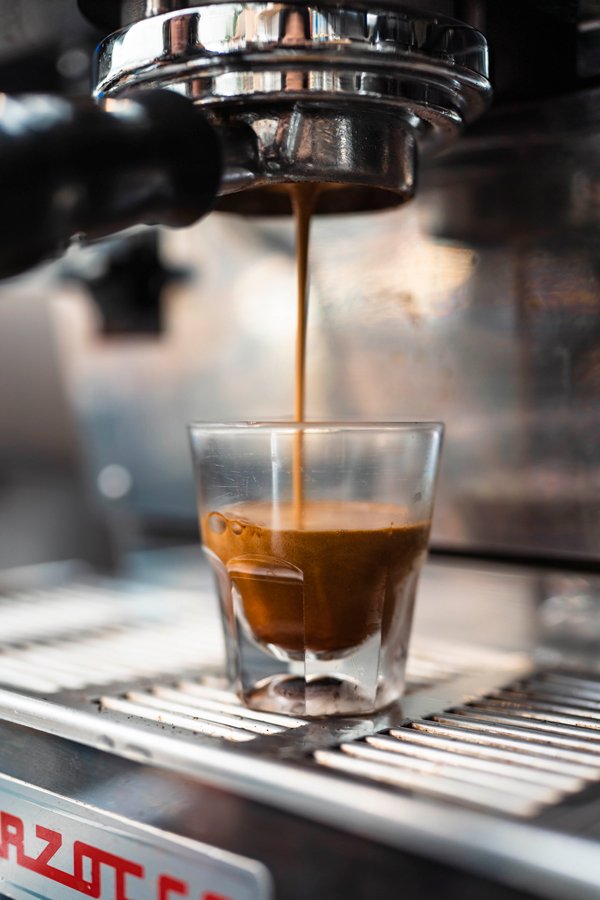
The height and width of the screenshot is (900, 600). I want to click on black handle, so click(47, 166).